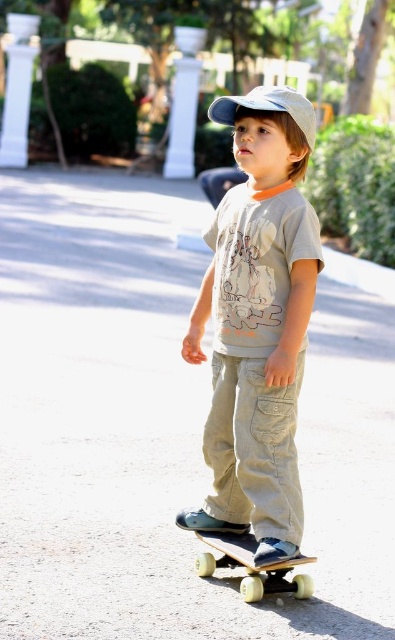
Question: Does light gray cotton shirt at center appear under yellow wheels skateboard at center?

Choices:
 (A) no
 (B) yes

Answer: (A)

Question: Can you confirm if light gray cotton shirt at center is thinner than white matte baseball hat at center?

Choices:
 (A) no
 (B) yes

Answer: (B)

Question: Which object is the farthest from the light gray cotton shirt at center?

Choices:
 (A) white matte baseball hat at center
 (B) yellow wheels skateboard at center

Answer: (A)

Question: Which is farther from the white matte baseball hat at center?

Choices:
 (A) light gray cotton shirt at center
 (B) yellow wheels skateboard at center

Answer: (B)

Question: Which of the following is the farthest from the observer?

Choices:
 (A) light gray cotton shirt at center
 (B) white matte baseball hat at center

Answer: (B)

Question: Can you confirm if light gray cotton shirt at center is smaller than yellow wheels skateboard at center?

Choices:
 (A) yes
 (B) no

Answer: (B)